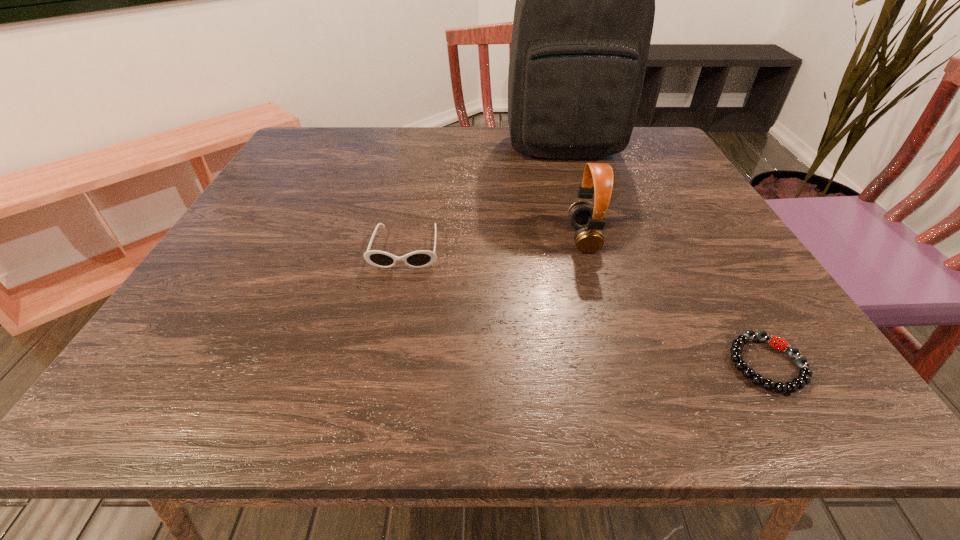
Where is `backpack`? backpack is located at coordinates (585, 0).

The width and height of the screenshot is (960, 540). What are the coordinates of `the farthest object` in the screenshot? It's located at point(585,0).

This screenshot has height=540, width=960. In order to click on the third shortest object in this screenshot , I will do `click(589, 222)`.

Image resolution: width=960 pixels, height=540 pixels. In order to click on the third tallest object in this screenshot , I will do `click(422, 258)`.

The image size is (960, 540). I want to click on sunglasses, so click(x=422, y=258).

Locate an element on the screen. The height and width of the screenshot is (540, 960). the shortest object is located at coordinates (804, 378).

Image resolution: width=960 pixels, height=540 pixels. What are the coordinates of `the nearest object` in the screenshot? It's located at (804, 378).

Locate an element on the screen. The height and width of the screenshot is (540, 960). vacant area located on the front-facing side of the tallest object is located at coordinates (588, 227).

The image size is (960, 540). What are the coordinates of `vacant space located 0.300m on the ear cups of the headset` in the screenshot? It's located at (417, 239).

Locate an element on the screen. The width and height of the screenshot is (960, 540). vacant space located on the ear cups of the headset is located at coordinates (462, 239).